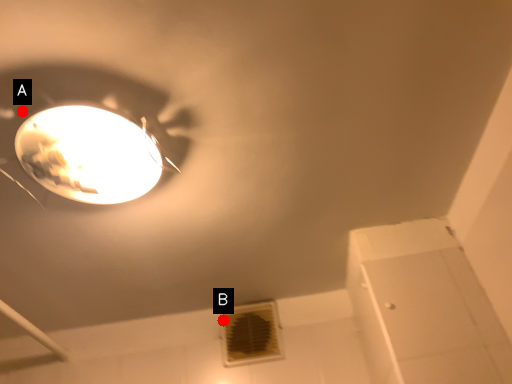
Question: Two points are circled on the image, labeled by A and B beside each circle. Which point is farther to the camera?

Choices:
 (A) A is further
 (B) B is further

Answer: (B)